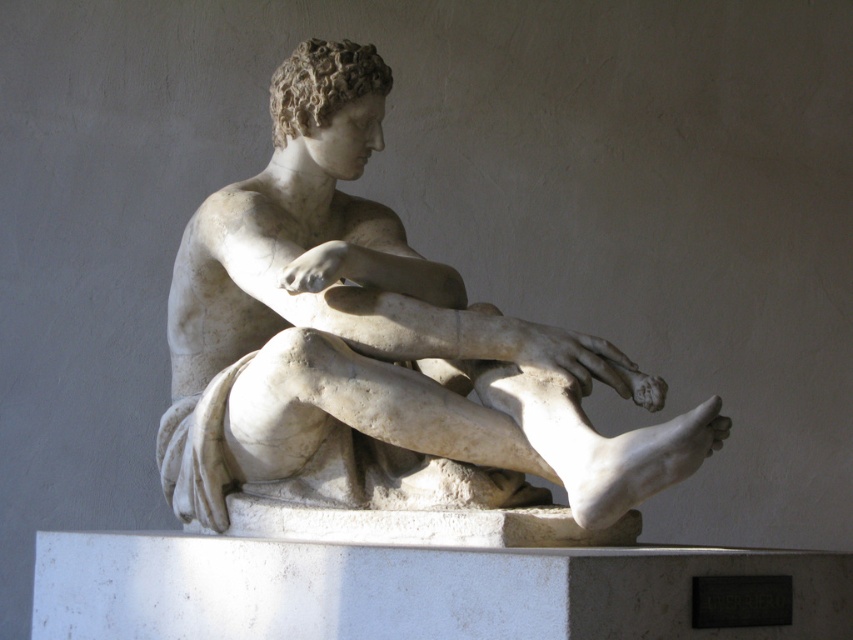
Question: Which object is farther from the camera taking this photo?

Choices:
 (A) white marble statue at center
 (B) white marble pillar at center

Answer: (A)

Question: Does white marble statue at center appear under white marble pillar at center?

Choices:
 (A) no
 (B) yes

Answer: (A)

Question: Can you confirm if white marble statue at center is smaller than white marble pillar at center?

Choices:
 (A) yes
 (B) no

Answer: (A)

Question: Is white marble statue at center wider than white marble pillar at center?

Choices:
 (A) no
 (B) yes

Answer: (A)

Question: Which point is farther to the camera?

Choices:
 (A) (341, 408)
 (B) (651, 570)

Answer: (A)

Question: Among these objects, which one is nearest to the camera?

Choices:
 (A) white marble pillar at center
 (B) white marble statue at center

Answer: (A)